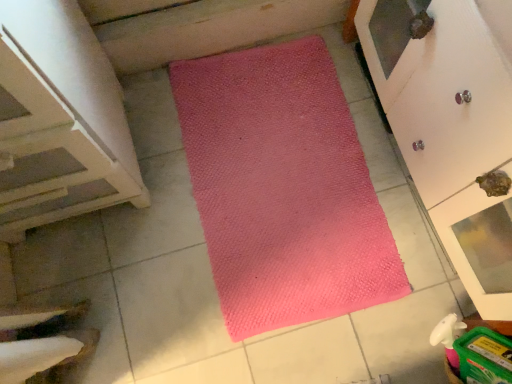
Image resolution: width=512 pixels, height=384 pixels. In order to click on vacant area that is situated to the right of white wood stairs at left in this screenshot , I will do point(164,190).